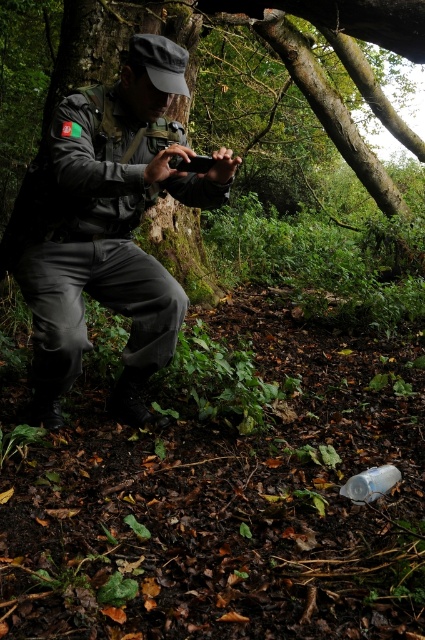
You are a hiker trying to decide whether to place your 15 cm wide backpack between the green mossy tree trunk at center and the transparent plastic bottle at lower center. Based on their sizes, can you fit your backpack there?

The green mossy tree trunk at center is bigger than the transparent plastic bottle at lower center, so the space between them might be sufficient for your 15 cm wide backpack. However, the exact fit depends on the distance between the two objects, which isn

In the scene shown: Based on the scene description, if you were to look at the image, which object would you see first when focusing on the central area? The matte black uniform at center or the green mossy tree trunk at center?

The matte black uniform at center is to the right of the green mossy tree trunk at center, so depending on your viewing angle, you might notice the green mossy tree trunk at center first as it is positioned to the left of the matte black uniform at center.

You are standing at the point labeled as point (62, 385) in the forest. You want to throw a rock to the person who is crouched and holding a device. Can you reach them if your maximum throwing distance is 3 meters?

The distance between you and the person is 2.65 meters, which is within your maximum throwing distance of 3 meters. Yes, you can reach them.